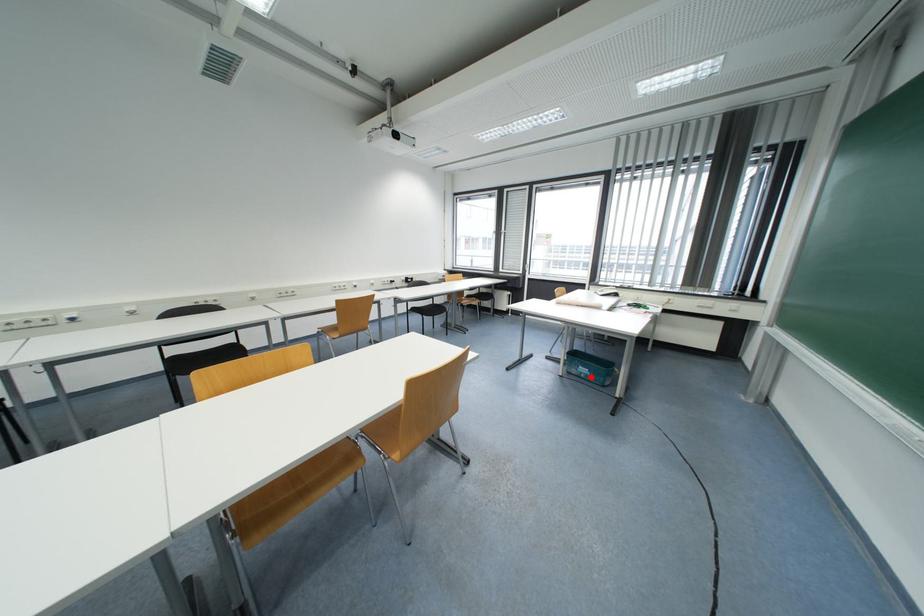
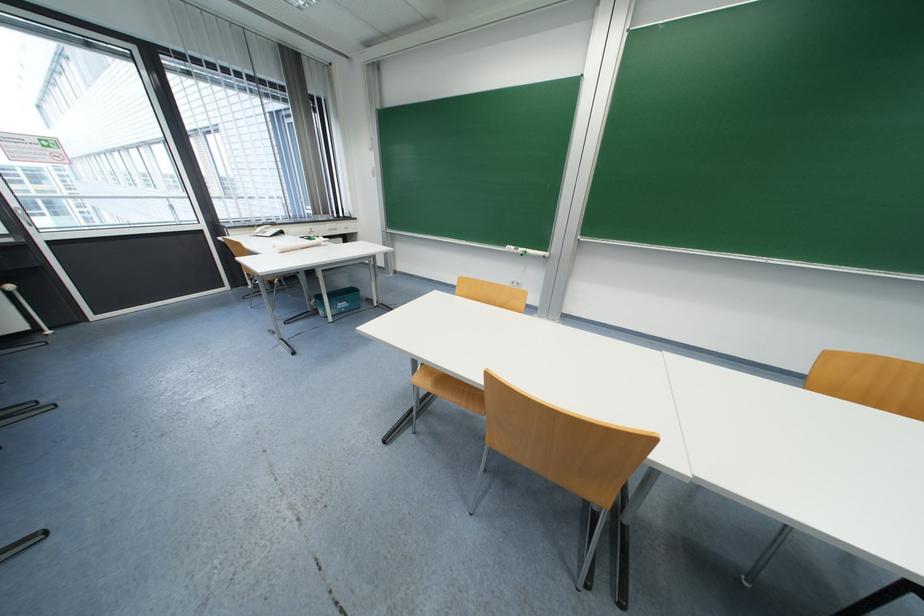
Question: I am providing you with two images of the same scene from different viewpoints. Given a red point in image1, look at the same physical point in image2. Is it:

Choices:
 (A) Closer to the viewpoint
 (B) Farther from the viewpoint

Answer: (B)